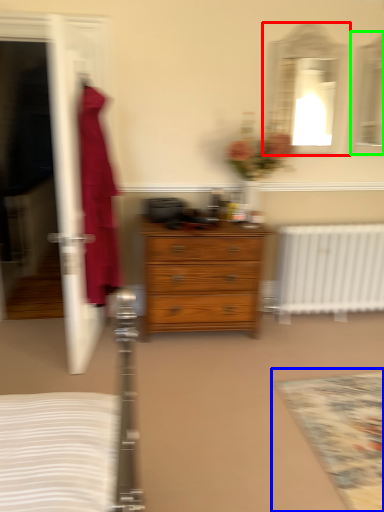
Question: Which is nearer to the mirror (highlighted by a red box)? mat (highlighted by a blue box) or mirror (highlighted by a green box).

Choices:
 (A) mat
 (B) mirror

Answer: (B)